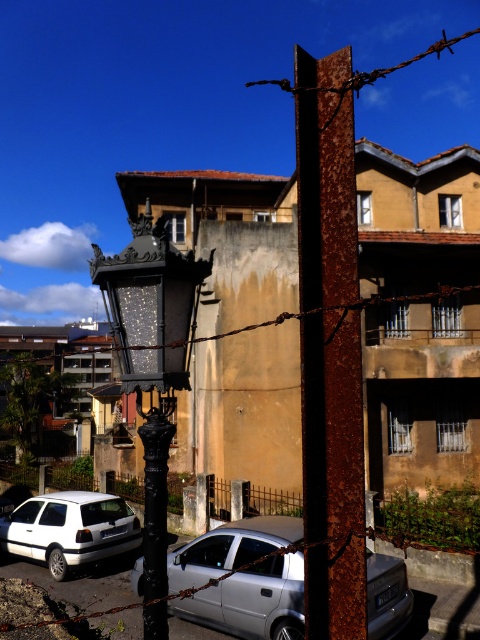
Looking at this image, between rusty metal pole at center and white matte hatchback at lower left, which one appears on the left side from the viewer's perspective?

white matte hatchback at lower left is more to the left.

Does rusty metal pole at center have a greater width compared to white matte hatchback at lower left?

No, rusty metal pole at center is not wider than white matte hatchback at lower left.

Is point (359, 586) behind point (46, 524)?

No, it is not.

In order to click on rusty metal pole at center in this screenshot , I will do `click(330, 348)`.

Can you confirm if black wrought iron streetlamp at center-left is wider than silver metallic car at center?

Correct, the width of black wrought iron streetlamp at center-left exceeds that of silver metallic car at center.

Which of these two, black wrought iron streetlamp at center-left or silver metallic car at center, stands taller?

With more height is black wrought iron streetlamp at center-left.

What do you see at coordinates (152, 369) in the screenshot?
I see `black wrought iron streetlamp at center-left` at bounding box center [152, 369].

Locate an element on the screen. black wrought iron streetlamp at center-left is located at coordinates (152, 369).

In the scene shown: Does silver metallic car at center lie in front of rusty metal fence at lower center?

Yes, it is.

Which is behind, point (236, 556) or point (376, 516)?

Point (376, 516)

You are a GUI agent. You are given a task and a screenshot of the screen. Output one action in this format:
    pyautogui.click(x=<x>, y=<y>)
    Task: Click on the silver metallic car at center
    This screenshot has width=480, height=640.
    Given the screenshot: What is the action you would take?
    pyautogui.click(x=252, y=602)